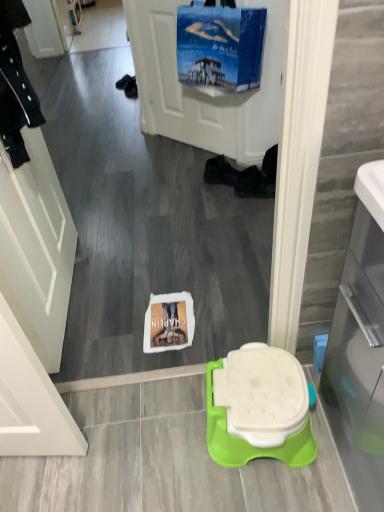
Locate an element on the screen. The height and width of the screenshot is (512, 384). vacant space to the left of blue fabric screen door at upper center, which is the second screen door in left-to-right order is located at coordinates (139, 152).